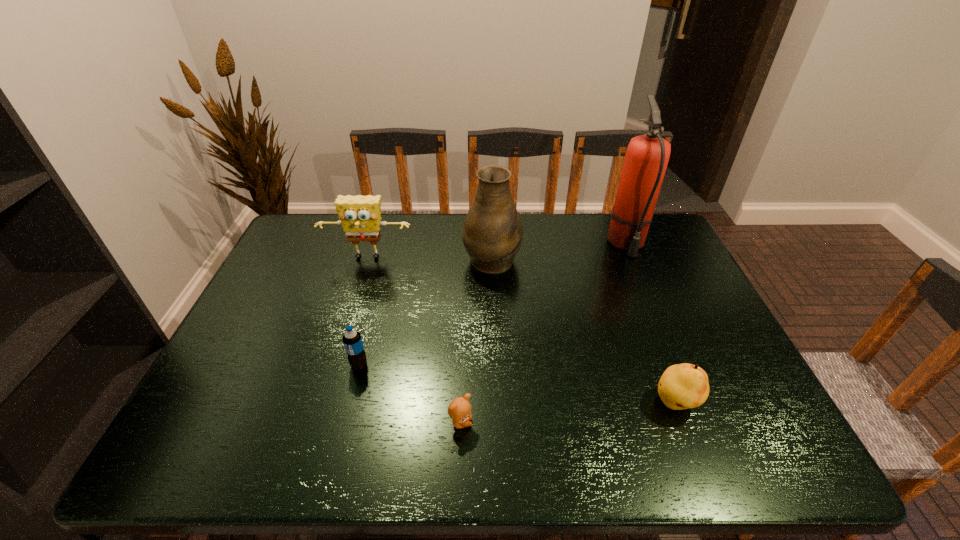
At what (x,y) coordinates should I click in order to perform the action: click on free space that satisfies the following two spatial constraints: 1. on the face of the fourth shortest object; 2. on the right side of the pear. Please return your answer as a coordinate pair (x, y). Looking at the image, I should click on (324, 403).

Identify the location of free location that satisfies the following two spatial constraints: 1. on the face of the pear; 2. on the left side of the fourth shortest object. Image resolution: width=960 pixels, height=540 pixels. (324, 403).

The image size is (960, 540). Find the location of `vacant space that satisfies the following two spatial constraints: 1. on the face of the third tallest object; 2. on the left side of the third nearest object`. vacant space that satisfies the following two spatial constraints: 1. on the face of the third tallest object; 2. on the left side of the third nearest object is located at coordinates (335, 365).